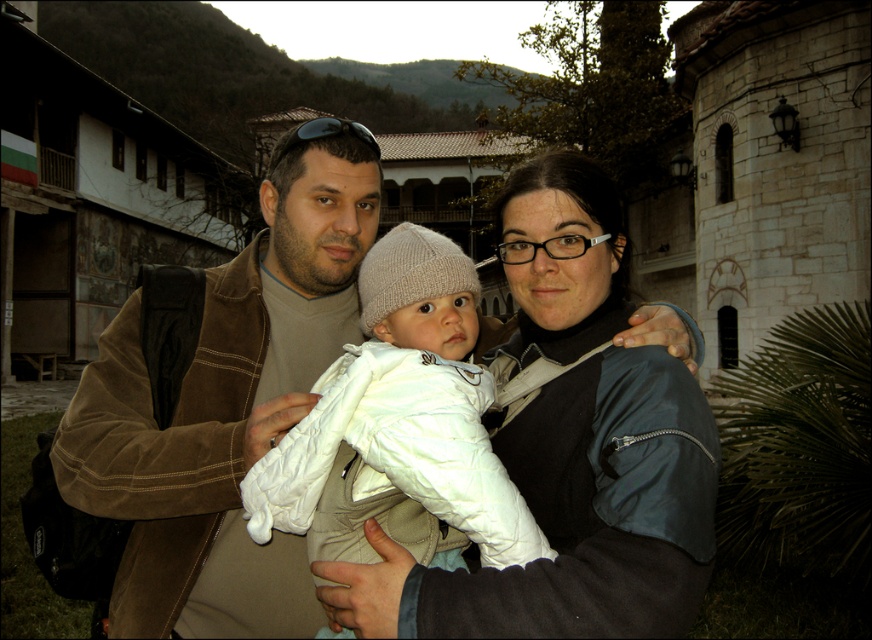
Is brown suede jacket at center above white soft fabric baby at center?

Yes, brown suede jacket at center is above white soft fabric baby at center.

Is brown suede jacket at center to the right of white soft fabric baby at center from the viewer's perspective?

Incorrect, brown suede jacket at center is not on the right side of white soft fabric baby at center.

Identify the location of brown suede jacket at center. (218, 416).